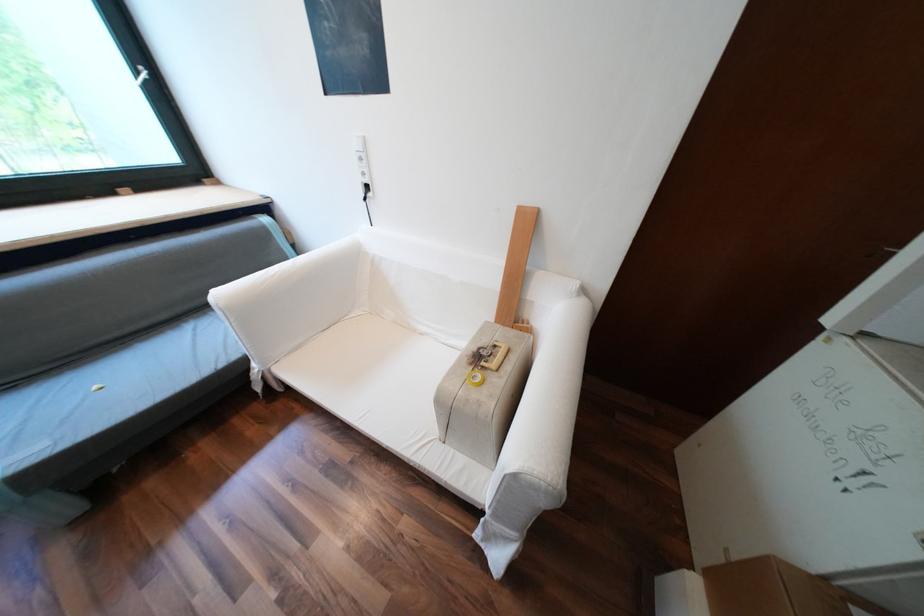
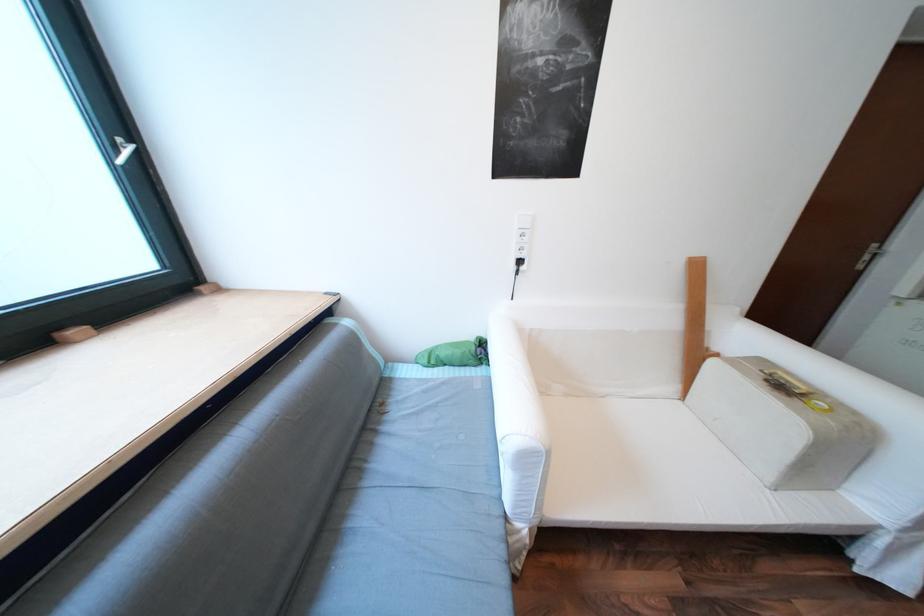
In the second image, find the point that corresponds to (x=492, y=368) in the first image.

(811, 394)